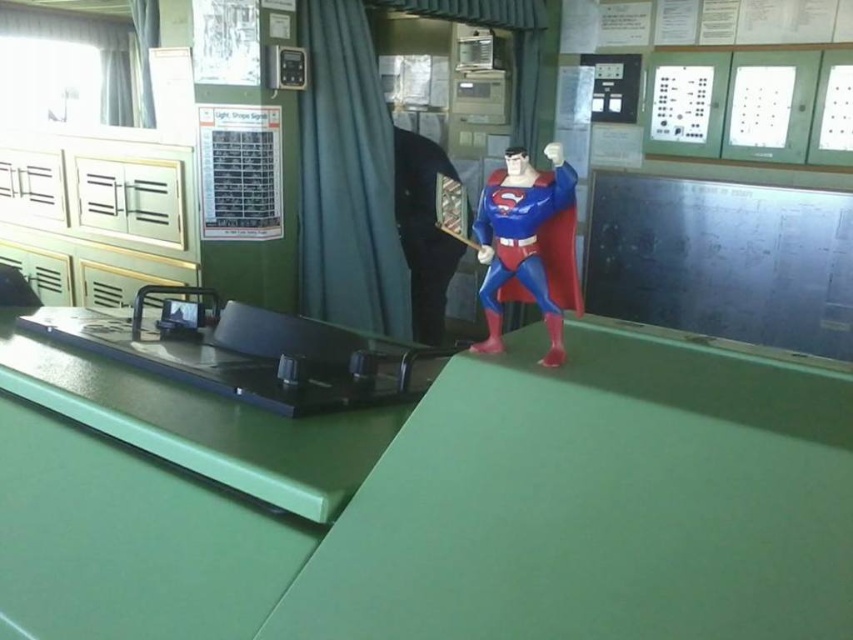
You are an interior designer planning to place a new decorative item on the pool table. The blue plastic superman figure at center and the smooth black suit at center are already there. Which object would require a narrower space to accommodate the new item?

The blue plastic superman figure at center is thinner than the smooth black suit at center, so placing the new item next to the blue plastic superman figure at center would require less space compared to the smooth black suit at center.

You are a visitor in this room and want to take a photo of the blue plastic superman figure at center and the smooth black suit at center. Which object should you focus on first to ensure both are in the frame?

The blue plastic superman figure at center is in front of the smooth black suit at center, so you should focus on the blue plastic superman figure at center first to ensure both are in the frame.

You are standing in the control room and want to determine which of the two points, point (498, 316) or point (425, 317), is closer to you. Based on the scene, which point is nearer?

Point (498, 316) is closer to the camera than point (425, 317), so it is nearer to you.